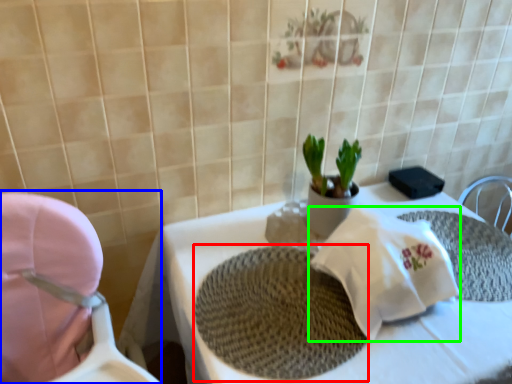
Question: Which is nearer to the place mat (highlighted by a red box)? baby carriage (highlighted by a blue box) or material (highlighted by a green box).

Choices:
 (A) baby carriage
 (B) material

Answer: (B)